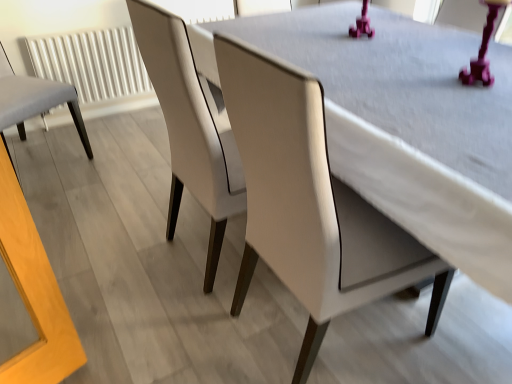
In order to click on vacant position to the left of matte white chair at center, placed as the second chair when sorted from right to left in this screenshot , I will do `click(122, 250)`.